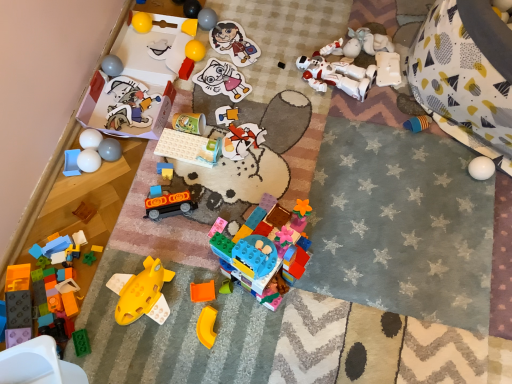
Identify the location of vacant space that's between yellow matte block at center, which is counted as the eleventh toy, starting from the left, and yellow matte plastic piece at center, the seventh toy when ordered from right to left. This screenshot has width=512, height=384. (197, 167).